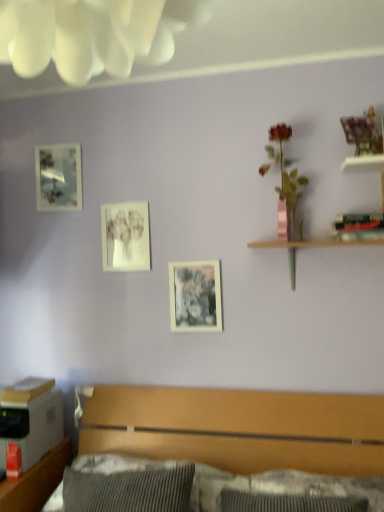
I want to click on pink metallic vase at upper right, so click(283, 167).

At what (x,y) coordinates should I click in order to perform the action: click on wooden bed at lower center. Please return your answer as a coordinate pair (x, y). Looking at the image, I should click on (238, 428).

Identify the location of pink metallic vase at upper right. This screenshot has height=512, width=384. (283, 167).

Is matte paper picture frame at center, the second picture frame positioned from the back, in contact with matte black picture frame at upper left, positioned as the 3th picture frame in right-to-left order?

There is a gap between matte paper picture frame at center, the second picture frame positioned from the back, and matte black picture frame at upper left, positioned as the 3th picture frame in right-to-left order.

Which of these two, matte paper picture frame at center, which ranks as the 2th picture frame in right-to-left order, or matte black picture frame at upper left, placed as the 1th picture frame when sorted from top to bottom, is smaller?

With smaller size is matte paper picture frame at center, which ranks as the 2th picture frame in right-to-left order.

This screenshot has height=512, width=384. I want to click on picture frame that is the 1st object located in front of the matte black picture frame at upper left, which ranks as the 1th picture frame in back-to-front order, so click(x=125, y=236).

From a real-world perspective, is matte paper picture frame at center, placed as the 2th picture frame when sorted from top to bottom, physically below matte black picture frame at upper left, which ranks as the 3th picture frame in bottom-to-top order?

Yes, from a real-world perspective, matte paper picture frame at center, placed as the 2th picture frame when sorted from top to bottom, is beneath matte black picture frame at upper left, which ranks as the 3th picture frame in bottom-to-top order.

Does brushed wood dresser at lower left have a greater height compared to wooden bed at lower center?

Yes.

From the picture: Which is more to the left, brushed wood dresser at lower left or wooden bed at lower center?

brushed wood dresser at lower left is more to the left.

Is brushed wood dresser at lower left oriented away from wooden bed at lower center?

brushed wood dresser at lower left is not turned away from wooden bed at lower center.

Is brushed wood dresser at lower left further to camera compared to wooden bed at lower center?

Yes, brushed wood dresser at lower left is further from the camera.

In the scene shown: Who is smaller, matte paper picture frame at center, which ranks as the 2th picture frame in right-to-left order, or black matte picture frame at center, the 3th picture frame when ordered from left to right?

matte paper picture frame at center, which ranks as the 2th picture frame in right-to-left order.

Between matte paper picture frame at center, which ranks as the 2th picture frame in right-to-left order, and black matte picture frame at center, which is counted as the first picture frame, starting from the bottom, which one has larger width?

With larger width is black matte picture frame at center, which is counted as the first picture frame, starting from the bottom.

Where is `picture frame below the matte paper picture frame at center, placed as the 2th picture frame when sorted from top to bottom (from the image's perspective)`? picture frame below the matte paper picture frame at center, placed as the 2th picture frame when sorted from top to bottom (from the image's perspective) is located at coordinates (195, 296).

Between matte paper picture frame at center, marked as the second picture frame in a front-to-back arrangement, and black matte picture frame at center, marked as the 1th picture frame in a right-to-left arrangement, which one appears on the right side from the viewer's perspective?

From the viewer's perspective, black matte picture frame at center, marked as the 1th picture frame in a right-to-left arrangement, appears more on the right side.

Considering the sizes of objects pink metallic vase at upper right and black matte picture frame at center, which appears as the third picture frame when viewed from the back, in the image provided, who is shorter, pink metallic vase at upper right or black matte picture frame at center, which appears as the third picture frame when viewed from the back,?

Standing shorter between the two is black matte picture frame at center, which appears as the third picture frame when viewed from the back.

Is black matte picture frame at center, which is counted as the first picture frame, starting from the bottom, a part of pink metallic vase at upper right?

No, black matte picture frame at center, which is counted as the first picture frame, starting from the bottom, is not inside pink metallic vase at upper right.

Looking at this image, is pink metallic vase at upper right facing away from black matte picture frame at center, which appears as the third picture frame when viewed from the back?

No.

Would you say wooden shelf at upper right is a long distance from pink metallic vase at upper right?

No.

Is point (288, 249) positioned after point (294, 170)?

Yes.

Based on the photo, how distant is wooden shelf at upper right from pink metallic vase at upper right?

11.30 inches.

Is wooden shelf at upper right inside or outside of wooden bed at lower center?

→ wooden shelf at upper right is spatially situated outside wooden bed at lower center.

Who is taller, wooden shelf at upper right or wooden bed at lower center?

wooden bed at lower center.

Looking at this image, does wooden shelf at upper right turn towards wooden bed at lower center?

No, wooden shelf at upper right is not turned towards wooden bed at lower center.

Does wooden shelf at upper right appear on the right side of wooden bed at lower center?

Yes, wooden shelf at upper right is to the right of wooden bed at lower center.

How different are the orientations of wooden shelf at upper right and brushed wood dresser at lower left in degrees?

0.255 degrees.

From the image's perspective, which object appears higher, wooden shelf at upper right or brushed wood dresser at lower left?

wooden shelf at upper right appears higher in the image.

Does wooden shelf at upper right lie in front of brushed wood dresser at lower left?

No, wooden shelf at upper right is further to the viewer.

Who is bigger, wooden shelf at upper right or brushed wood dresser at lower left?

brushed wood dresser at lower left.

There is a matte black picture frame at upper left, marked as the first picture frame in a left-to-right arrangement. At what (x,y) coordinates should I click in order to perform the action: click on the 1st picture frame below it (from the image's perspective). Please return your answer as a coordinate pair (x, y). This screenshot has width=384, height=512. Looking at the image, I should click on (125, 236).

At what (x,y) coordinates should I click in order to perform the action: click on dresser on the left of wooden bed at lower center. Please return your answer as a coordinate pair (x, y). The image size is (384, 512). Looking at the image, I should click on (36, 481).

From the image, which object appears to be farther from matte paper picture frame at center, marked as the second picture frame in a front-to-back arrangement, brushed wood dresser at lower left or black matte picture frame at center, the 3th picture frame when ordered from left to right?

brushed wood dresser at lower left lies further to matte paper picture frame at center, marked as the second picture frame in a front-to-back arrangement, than the other object.

Consider the image. Considering their positions, is pink metallic vase at upper right positioned further to wooden shelf at upper right than black matte picture frame at center, the 3th picture frame when ordered from left to right?

black matte picture frame at center, the 3th picture frame when ordered from left to right, lies further to wooden shelf at upper right than the other object.

Based on their spatial positions, is matte paper picture frame at center, placed as the 2th picture frame when sorted from top to bottom, or matte black picture frame at upper left, which is counted as the 3th picture frame, starting from the front, further from pink metallic vase at upper right?

The object further to pink metallic vase at upper right is matte black picture frame at upper left, which is counted as the 3th picture frame, starting from the front.

When comparing their distances from matte black picture frame at upper left, marked as the first picture frame in a left-to-right arrangement, does wooden bed at lower center or pink metallic vase at upper right seem further?

wooden bed at lower center is positioned further to the anchor matte black picture frame at upper left, marked as the first picture frame in a left-to-right arrangement.

From the image, which object appears to be farther from matte paper picture frame at center, which ranks as the 2th picture frame in right-to-left order, brushed wood dresser at lower left or wooden bed at lower center?

Based on the image, brushed wood dresser at lower left appears to be further to matte paper picture frame at center, which ranks as the 2th picture frame in right-to-left order.

From the image, which object appears to be nearer to pink metallic vase at upper right, brushed wood dresser at lower left or matte black picture frame at upper left, placed as the 1th picture frame when sorted from top to bottom?

matte black picture frame at upper left, placed as the 1th picture frame when sorted from top to bottom, lies closer to pink metallic vase at upper right than the other object.

From the image, which object appears to be nearer to pink metallic vase at upper right, matte black picture frame at upper left, which ranks as the 3th picture frame in bottom-to-top order, or wooden shelf at upper right?

wooden shelf at upper right is positioned closer to the anchor pink metallic vase at upper right.

Consider the image. Considering their positions, is wooden bed at lower center positioned closer to wooden shelf at upper right than pink metallic vase at upper right?

pink metallic vase at upper right is positioned closer to the anchor wooden shelf at upper right.

The height and width of the screenshot is (512, 384). Find the location of `floral arrangement between brushed wood dresser at lower left and wooden shelf at upper right in the horizontal direction`. floral arrangement between brushed wood dresser at lower left and wooden shelf at upper right in the horizontal direction is located at coordinates coord(283,167).

Identify the location of floral arrangement between black matte picture frame at center, marked as the 1th picture frame in a right-to-left arrangement, and wooden shelf at upper right. (283, 167).

Locate an element on the screen. This screenshot has height=512, width=384. picture frame situated between matte black picture frame at upper left, which ranks as the 3th picture frame in bottom-to-top order, and black matte picture frame at center, positioned as the first picture frame in front-to-back order, from left to right is located at coordinates (125, 236).

What are the coordinates of `floral arrangement between matte black picture frame at upper left, which ranks as the 1th picture frame in back-to-front order, and brushed wood dresser at lower left vertically` in the screenshot? It's located at (283, 167).